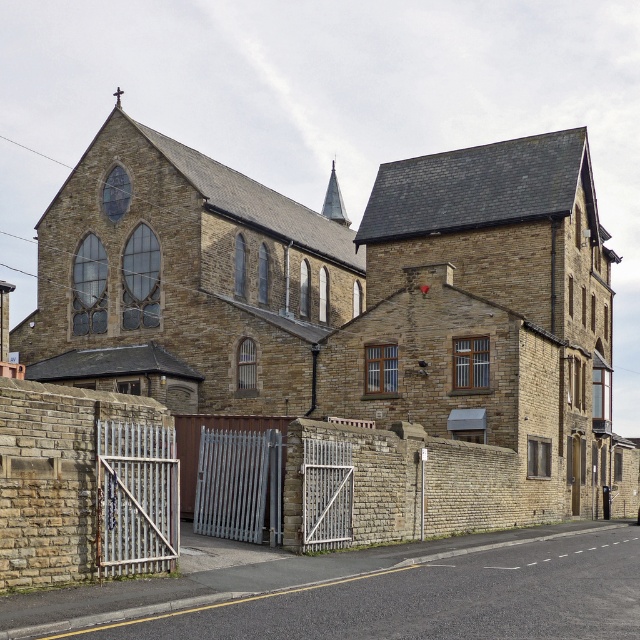
You are standing at point A located at coordinates point A at (74,301) and want to walk to point B located at coordinates point B at 0.527, 0.883. The straight line distance between them is 187.33 feet. If you walk at a constant speed of 3 feet per second, how many seconds will it take you to reach point B?

The straight line distance between point A at (74,301) and point B at 0.527, 0.883 is 187.33 feet. At a speed of 3 feet per second, the time required is 187.33 divided by 3, which equals approximately 62.44 seconds.

You are a photographer planning to take a picture of the brown stone church at center and the smooth gray spire at upper center. Based on their sizes, which one should you focus on to ensure it appears more prominent in the photo?

The brown stone church at center is larger in size than the smooth gray spire at upper center, so focusing on the brown stone church at center will make it appear more prominent in the photo.